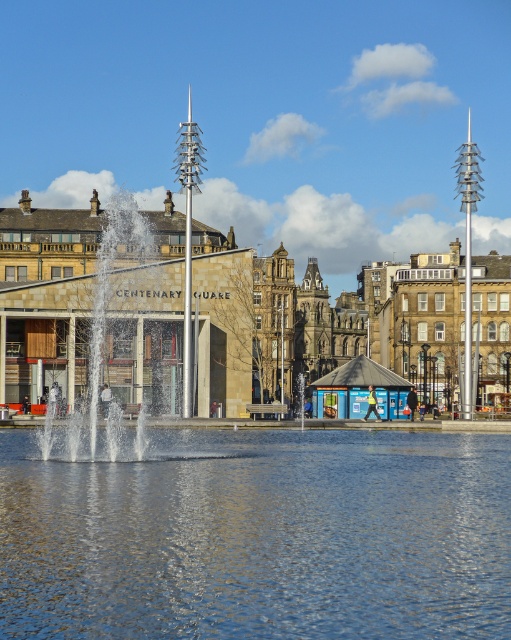
You are planning to install a new decorative statue between the clear water at center and the metallic fountain at center. Given that the statue requires a 30 feet clearance from both objects, is there enough space between them to place it?

The clear water at center and metallic fountain at center are 65.69 feet apart. Since the statue needs 30 feet clearance from both, the total required space is 60 feet. Since 65.69 is greater than 60, yes, there is enough space between them to place the statue.

You are an architect visiting the urban scene and need to determine which fountain is shorter between the polished stone fountain at center and the metallic fountain at center. Based on the scene, which one is shorter?

The polished stone fountain at center is not as tall as the metallic fountain at center, so the polished stone fountain at center is shorter.